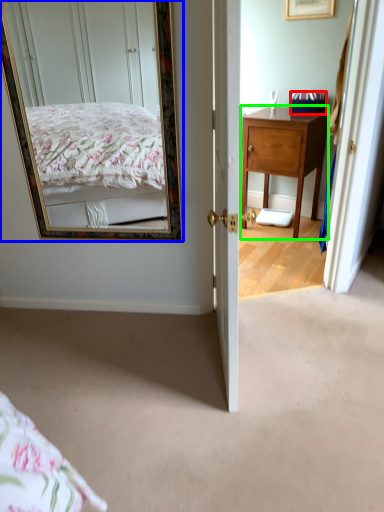
Question: Estimate the real-world distances between objects in this image. Which object is closer to box (highlighted by a red box), mirror (highlighted by a blue box) or desk (highlighted by a green box)?

Choices:
 (A) mirror
 (B) desk

Answer: (B)